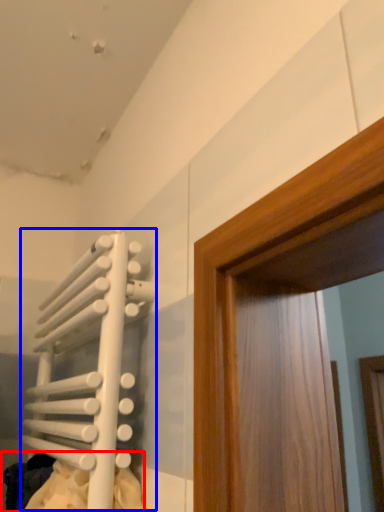
Question: Which object is closer to the camera taking this photo, laundry (highlighted by a red box) or radiator (highlighted by a blue box)?

Choices:
 (A) laundry
 (B) radiator

Answer: (B)